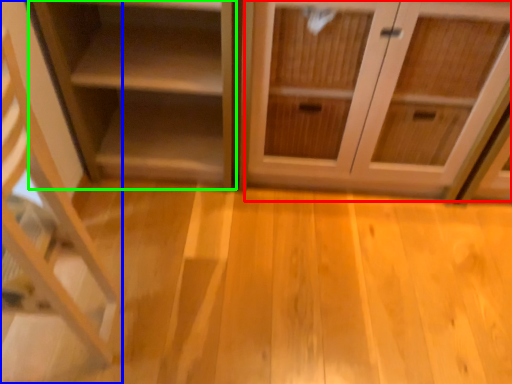
Question: Estimate the real-world distances between objects in this image. Which object is closer to cabinetry (highlighted by a red box), shelf (highlighted by a blue box) or shelf (highlighted by a green box)?

Choices:
 (A) shelf
 (B) shelf

Answer: (B)